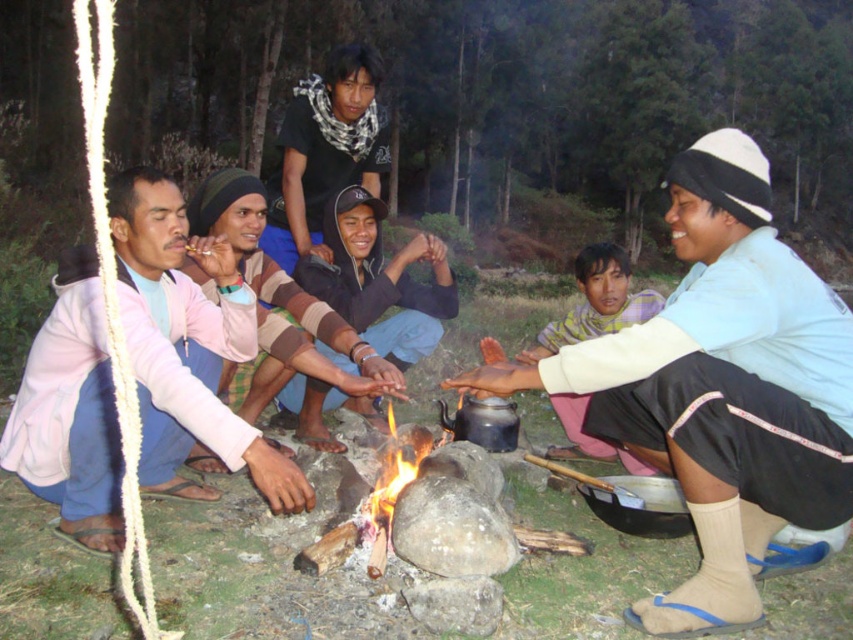
Question: Which point is farther from the camera taking this photo?

Choices:
 (A) (328, 300)
 (B) (815, 292)

Answer: (A)

Question: Observing the image, what is the correct spatial positioning of light blue cotton shirt at center in reference to purple striped shirt at center?

Choices:
 (A) above
 (B) below

Answer: (B)

Question: Among these points, which one is nearest to the camera?

Choices:
 (A) (146, 481)
 (B) (589, 445)
 (C) (762, 294)
 (D) (358, 198)

Answer: (C)

Question: Does pink fabric pants at lower left have a lesser width compared to purple striped shirt at center?

Choices:
 (A) no
 (B) yes

Answer: (A)

Question: Which of these objects is positioned closest to the brown striped sweater at center?

Choices:
 (A) matte black jacket at center
 (B) pink fabric pants at lower left
 (C) light blue cotton shirt at center
 (D) purple striped shirt at center

Answer: (A)

Question: Can you confirm if brown striped sweater at center is thinner than purple striped shirt at center?

Choices:
 (A) yes
 (B) no

Answer: (B)